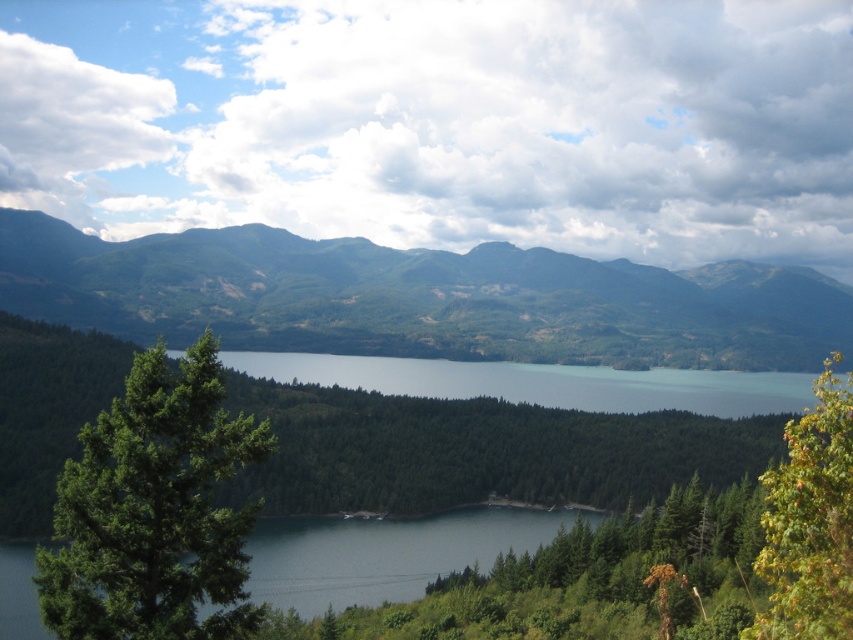
Question: Observing the image, what is the correct spatial positioning of green forested mountain at center in reference to yellow-green leafy tree at right?

Choices:
 (A) right
 (B) left

Answer: (B)

Question: Which point is closer to the camera taking this photo?

Choices:
 (A) (838, 474)
 (B) (183, 472)
 (C) (741, 360)

Answer: (A)

Question: Does green matte tree at left have a greater width compared to yellow-green leafy tree at right?

Choices:
 (A) no
 (B) yes

Answer: (A)

Question: Which object is positioned closest to the green matte tree at left?

Choices:
 (A) yellow-green leafy tree at right
 (B) green forested mountain at center

Answer: (A)

Question: Does green forested mountain at center have a smaller size compared to yellow-green leafy tree at right?

Choices:
 (A) no
 (B) yes

Answer: (A)

Question: Which point appears closest to the camera in this image?

Choices:
 (A) click(x=850, y=536)
 (B) click(x=155, y=593)
 (C) click(x=363, y=292)

Answer: (A)